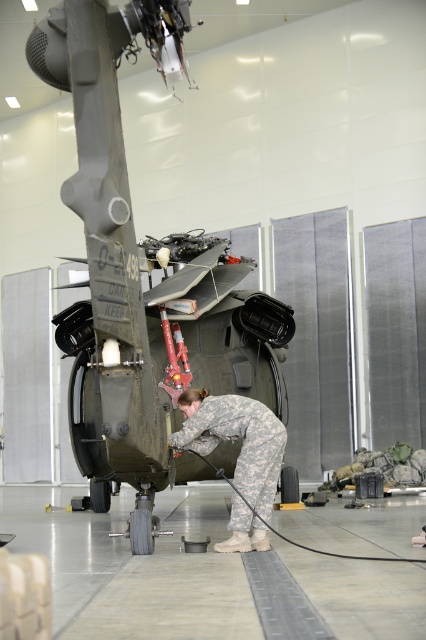
You are a maintenance supervisor in the hangar. You need to ensure that the green matte helicopter at center is large enough to accommodate the camouflage uniform at center for a full body inspection. Can you confirm if the helicopter is big enough?

The green matte helicopter at center is bigger than the camouflage uniform at center, so yes, the helicopter is large enough to accommodate the camouflage uniform at center for a full body inspection.

You are standing in the hangar and need to locate the green matte helicopter at center. According to the coordinates provided, where exactly is it positioned?

The green matte helicopter at center is located at the coordinates point (155, 298).